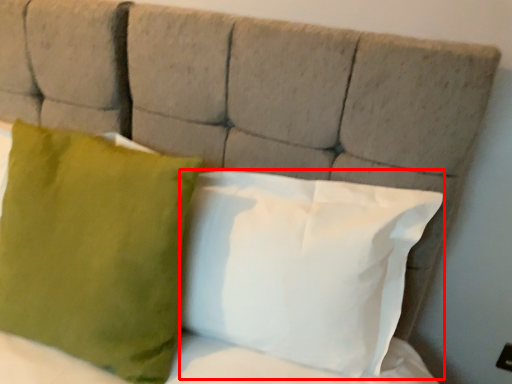
Question: From the image's perspective, what is the correct spatial relationship of pillow (annotated by the red box) in relation to pillow?

Choices:
 (A) below
 (B) above

Answer: (A)